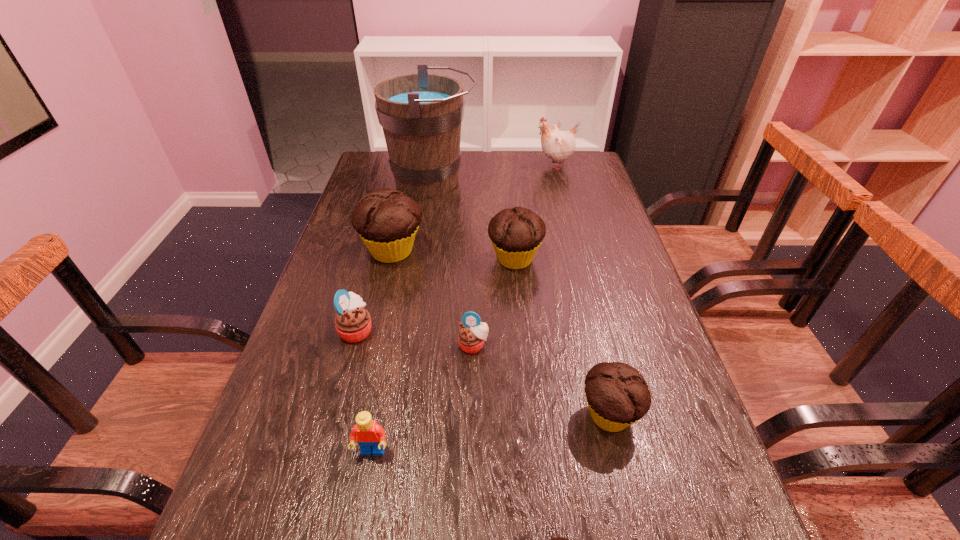
Find the location of a particular element. The height and width of the screenshot is (540, 960). object that is the fifth closest to the red Lego is located at coordinates (387, 220).

This screenshot has width=960, height=540. Identify the location of the third closest object to the smallest chocolate muffin. (471, 337).

Locate an element on the screen. Image resolution: width=960 pixels, height=540 pixels. muffin that stands as the second closest to the white bird is located at coordinates (387, 220).

Select which muffin is the fourth closest to the red Lego. Please provide its 2D coordinates. Your answer should be formatted as a tuple, i.e. [(x, y)], where the tuple contains the x and y coordinates of a point satisfying the conditions above.

[(617, 394)]

Locate which chocolate muffin is the third closest to the smallest chocolate muffin. Please provide its 2D coordinates. Your answer should be formatted as a tuple, i.e. [(x, y)], where the tuple contains the x and y coordinates of a point satisfying the conditions above.

[(387, 220)]

Find the location of a particular element. the third closest chocolate muffin to the leftmost chocolate muffin is located at coordinates click(x=558, y=539).

I want to click on vacant space that satisfies the following two spatial constraints: 1. on the back side of the rightmost chocolate muffin; 2. on the front-facing side of the bigger pink muffin, so click(588, 330).

I want to click on vacant space that satisfies the following two spatial constraints: 1. at the beak of the white bird; 2. on the face of the red Lego, so click(630, 452).

Image resolution: width=960 pixels, height=540 pixels. Identify the location of vacant space that satisfies the following two spatial constraints: 1. with a handle on the side of the tallest object; 2. on the face of the Lego. (389, 452).

Image resolution: width=960 pixels, height=540 pixels. In order to click on free region that satisfies the following two spatial constraints: 1. on the front-facing side of the bigger pink muffin; 2. on the back side of the rightmost chocolate muffin in this screenshot , I will do `click(333, 415)`.